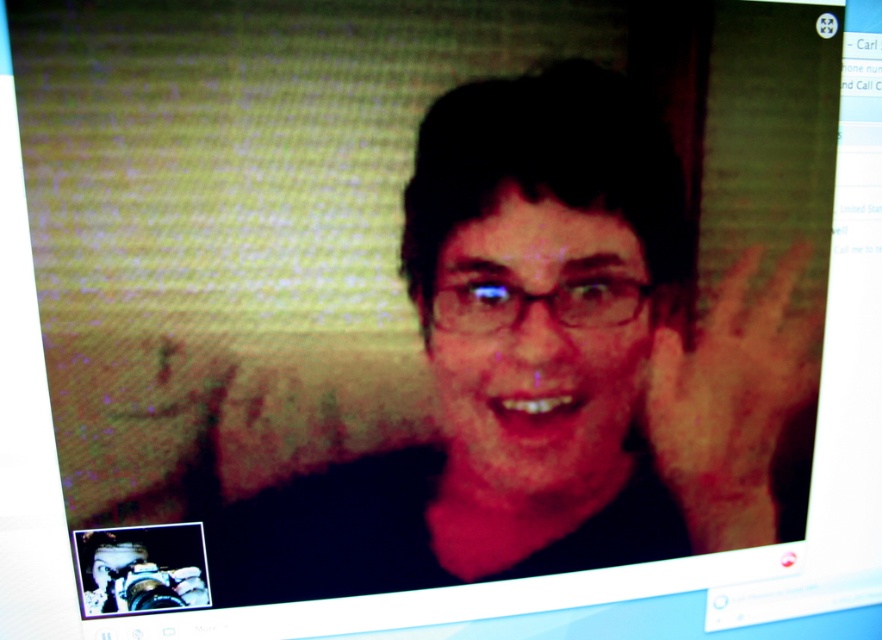
You are setting up a video call and want to ensure both the matte black face at center and the brown skin at right are visible. Based on their sizes in the frame, which one might be more prominent to viewers?

The matte black face at center is bigger than the brown skin at right, so it will appear more prominent to viewers.

You are a video editor reviewing a video call recording. You notice two skin tones in the frame, the matte black face at center and the brown skin at right. Which skin tone is positioned higher in the image?

The matte black face at center is positioned higher in the image than the brown skin at right.